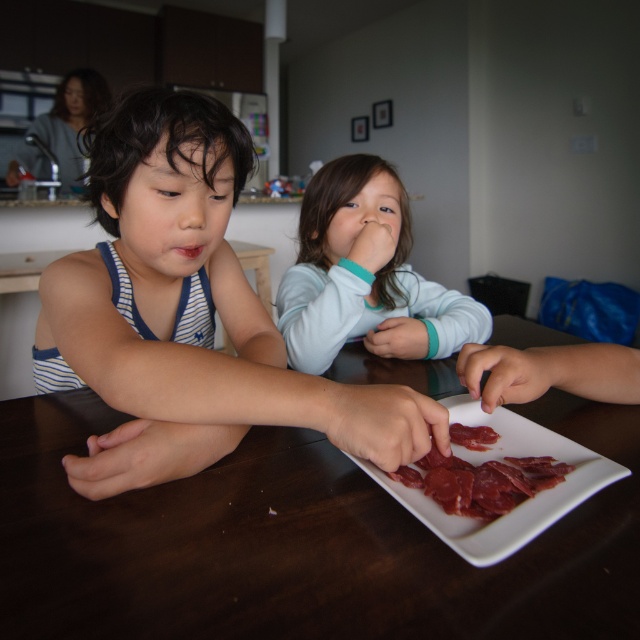
You are a parent trying to determine if the blue striped tank top at left can be placed on the dried meat at center without overlapping. Based on their sizes, is this possible?

The blue striped tank top at left might be wider than dried meat at center, so there is a possibility that placing the tank top on the meat could cause overlapping. To avoid overlap, ensure the tank top is positioned carefully or choose a different spot.

You are a parent observing your children at the table. You notice the smooth white shirt at center and the white glossy platter at center. Which object is bigger in size?

The smooth white shirt at center is larger in size compared to the white glossy platter at center.

From the picture: You are a photographer trying to capture a candid shot of the two children at the table. You notice two points of interest marked as point 1 at coordinates point (289, 296) and point 2 at coordinates point (472, 413). Which point should you focus on to ensure the subject is in sharp focus if you want to prioritize the child closer to the camera?

Point 1 at coordinates point (289, 296) should be focused on because it is closer to the camera compared to point 2 at coordinates point (472, 413), ensuring the child nearer to the camera is in sharp focus.